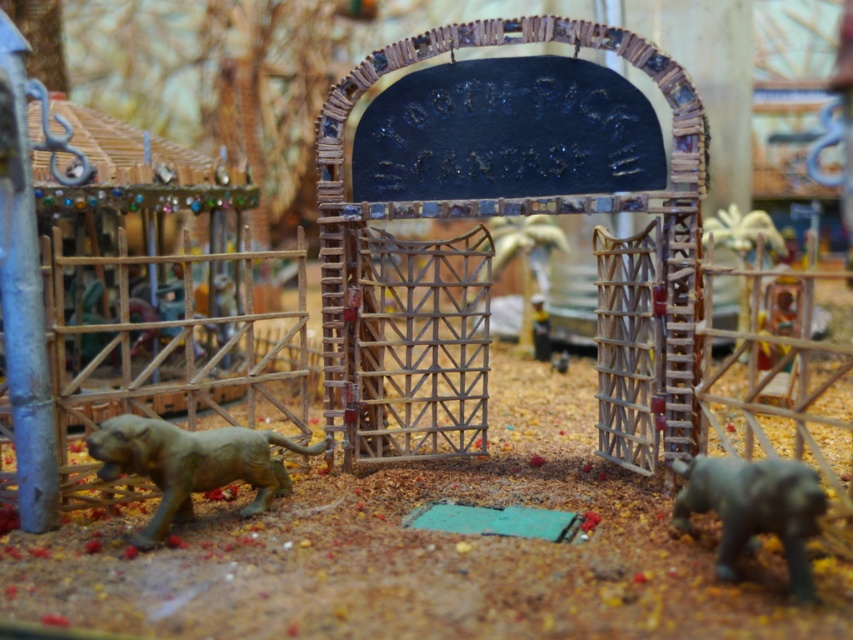
Based on the photo, you are a zookeeper who needs to place a 20 inch long fence panel between the gold metallic tiger at lower left and the gray matte baby elephant at lower right. Will the fence panel fit between them?

The distance between the gold metallic tiger at lower left and the gray matte baby elephant at lower right is 21.36 inches. Since the fence panel is 20 inches long, it will fit between them with 1.36 inches of space remaining.

You are a zookeeper who needs to feed the animals in the enclosure. The wooden gate at center is currently closed. To reach the gray matte baby elephant at lower right, do you need to open the gate?

The gray matte baby elephant at lower right is behind the wooden gate at center, so you need to open the gate to reach it.

You are standing in front of the wooden gate at the entrance of the zoo. There is a gold metallic tiger at lower left. Where exactly is the gold metallic tiger positioned relative to the gate?

The gold metallic tiger at lower left is positioned at coordinates approximately 0.727 on the x axis and 0.225 on the y axis relative to the gate.